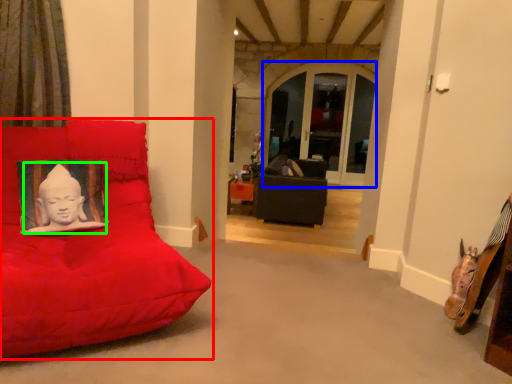
Question: Based on their relative distances, which object is farther from furniture (highlighted by a red box)? Choose from window (highlighted by a blue box) and person (highlighted by a green box).

Choices:
 (A) window
 (B) person

Answer: (A)